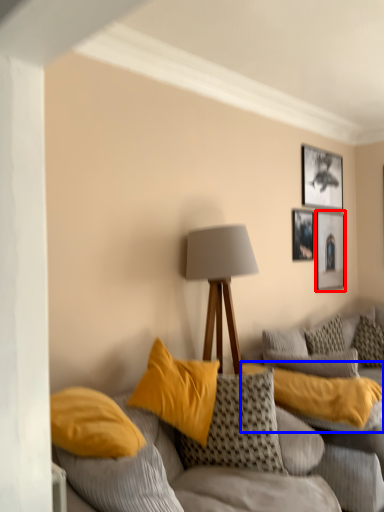
Question: Among these objects, which one is nearest to the camera, picture frame (highlighted by a red box) or pillow (highlighted by a blue box)?

Choices:
 (A) picture frame
 (B) pillow

Answer: (B)